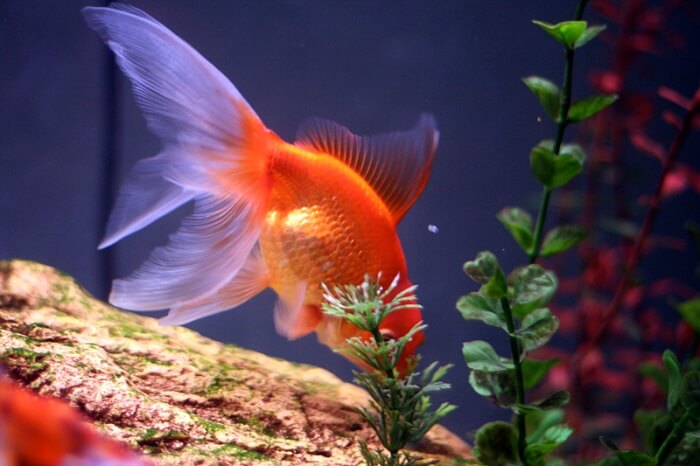
The height and width of the screenshot is (466, 700). Find the location of `scales`. scales is located at coordinates (323, 239).